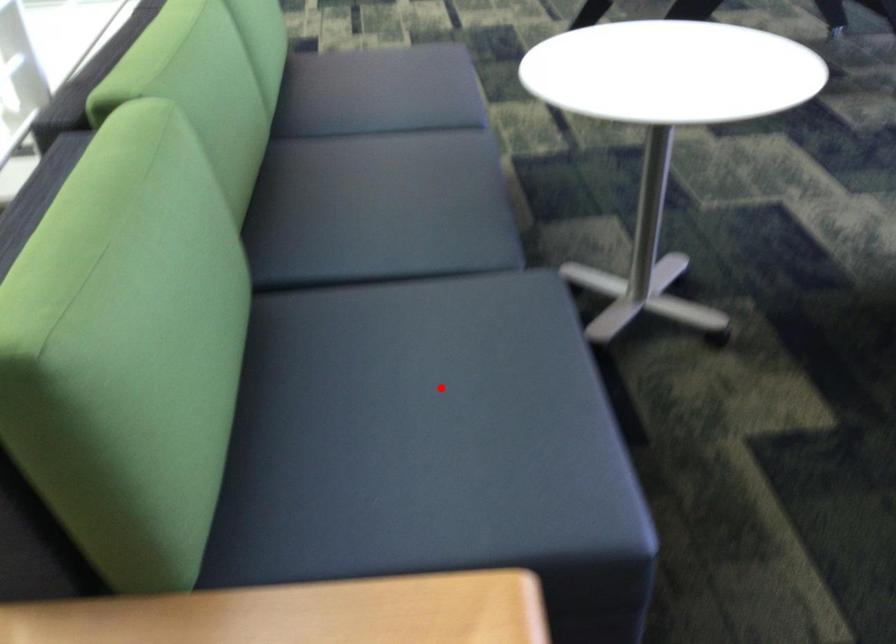
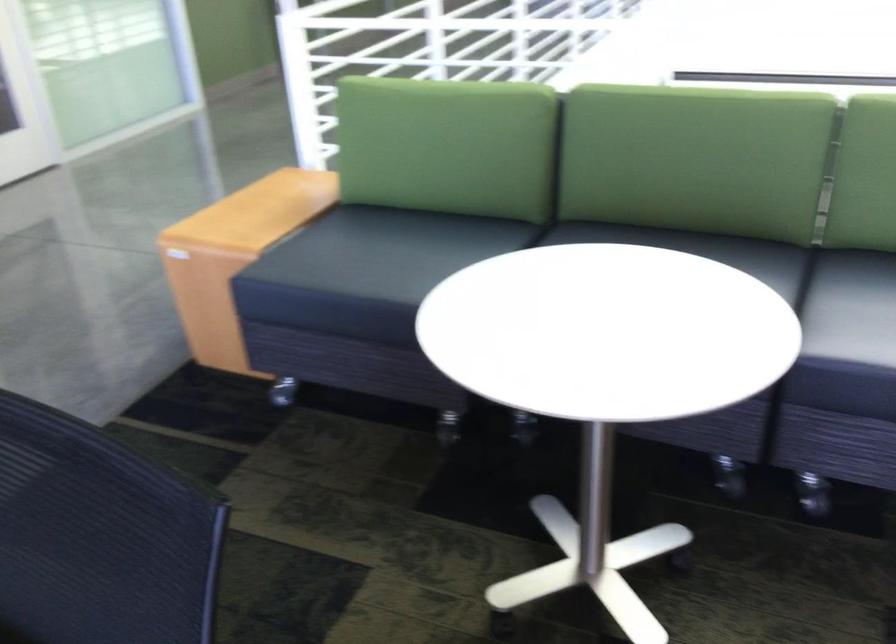
Question: A red point is marked in image1. In image2, is the corresponding 3D point closer to the camera or farther? Reply with the corresponding letter.

Choices:
 (A) The corresponding 3D point is closer.
 (B) The corresponding 3D point is farther.

Answer: (B)